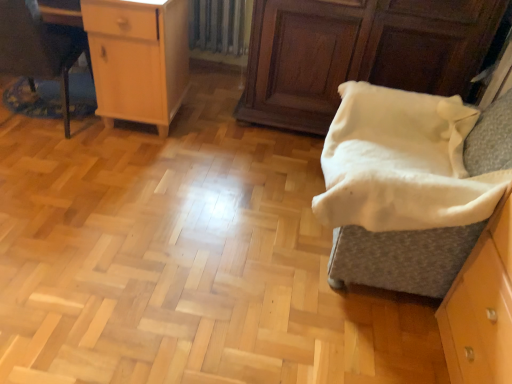
You are a GUI agent. You are given a task and a screenshot of the screen. Output one action in this format:
    pyautogui.click(x=<x>, y=<y>)
    Task: Click on the vacant space in front of light wood cabinet at upper left
    
    Given the screenshot: What is the action you would take?
    pyautogui.click(x=87, y=183)